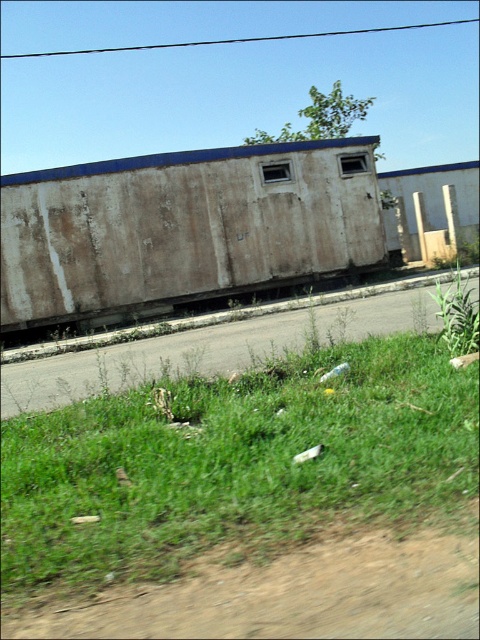
Who is positioned more to the left, rusty metal train car at center or green grass at lower right?

From the viewer's perspective, rusty metal train car at center appears more on the left side.

Does point (41, 243) come farther from viewer compared to point (450, 336)?

Yes, it is behind point (450, 336).

The image size is (480, 640). What are the coordinates of `rusty metal train car at center` in the screenshot? It's located at (183, 228).

From the picture: Does green grass at lower left appear under rusty metal train car at center?

Correct, green grass at lower left is located below rusty metal train car at center.

Between green grass at lower left and rusty metal train car at center, which one is positioned lower?

green grass at lower left is lower down.

This screenshot has width=480, height=640. What are the coordinates of `green grass at lower left` in the screenshot? It's located at (235, 461).

In order to click on green grass at lower left in this screenshot , I will do `click(235, 461)`.

From the picture: Between green grass at lower left and green grass at lower right, which one appears on the right side from the viewer's perspective?

Positioned to the right is green grass at lower right.

This screenshot has width=480, height=640. What do you see at coordinates (235, 461) in the screenshot?
I see `green grass at lower left` at bounding box center [235, 461].

Find the location of a particular element. The height and width of the screenshot is (640, 480). green grass at lower left is located at coordinates (235, 461).